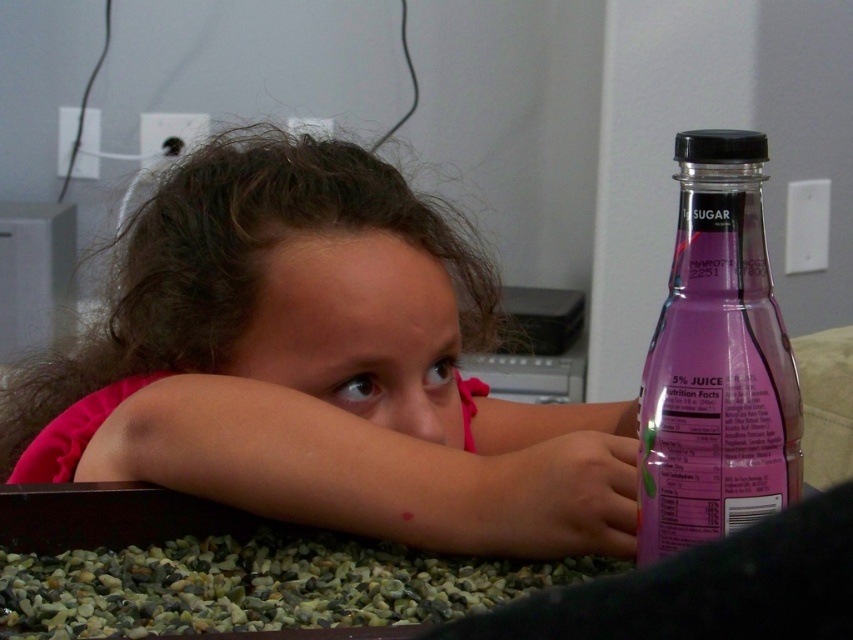
In the scene shown: Who is taller, purple glass bottle at right or translucent plastic hand at lower right?

Standing taller between the two is purple glass bottle at right.

Can you confirm if purple glass bottle at right is positioned below translucent plastic hand at lower right?

Incorrect, purple glass bottle at right is not positioned below translucent plastic hand at lower right.

You are a GUI agent. You are given a task and a screenshot of the screen. Output one action in this format:
    pyautogui.click(x=<x>, y=<y>)
    Task: Click on the purple glass bottle at right
    The height and width of the screenshot is (640, 853).
    Given the screenshot: What is the action you would take?
    point(717,362)

Identify the location of purple glass bottle at right. This screenshot has width=853, height=640. (717, 362).

Is pink fabric at center taller than purple glass bottle at right?

Yes.

Find the location of a particular element. This screenshot has width=853, height=640. pink fabric at center is located at coordinates (316, 368).

Is pink fabric at center to the right of translucent plastic hand at lower right from the viewer's perspective?

Incorrect, pink fabric at center is not on the right side of translucent plastic hand at lower right.

Does point (222, 493) lie behind point (508, 504)?

That is True.

What do you see at coordinates (316, 368) in the screenshot? I see `pink fabric at center` at bounding box center [316, 368].

Find the location of `pink fabric at center`. pink fabric at center is located at coordinates (316, 368).